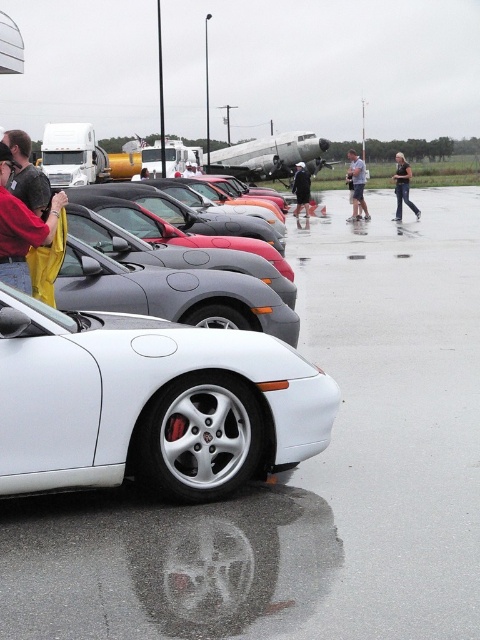
You are a photographer wanting to capture both the satin silver metallic sports car at center and the shiny black car at center in a single frame. Based on their heights, which car will appear larger in the photo?

The shiny black car at center will appear larger in the photo because it is taller than the satin silver metallic sports car at center.